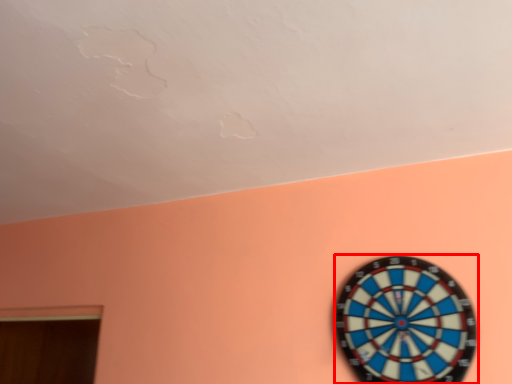
Question: Considering the relative positions of clock (annotated by the red box) and window in the image provided, where is clock (annotated by the red box) located with respect to the staircase?

Choices:
 (A) left
 (B) right

Answer: (B)